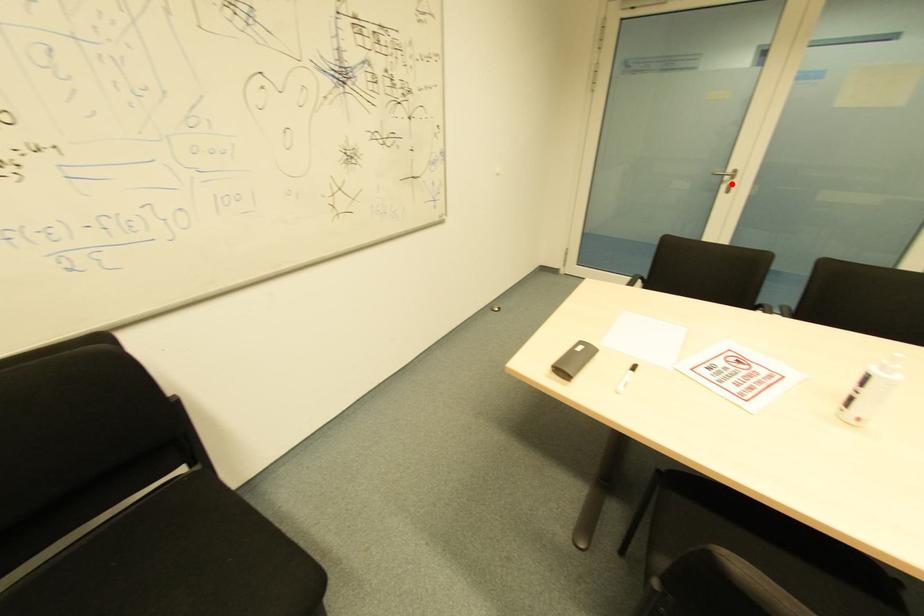
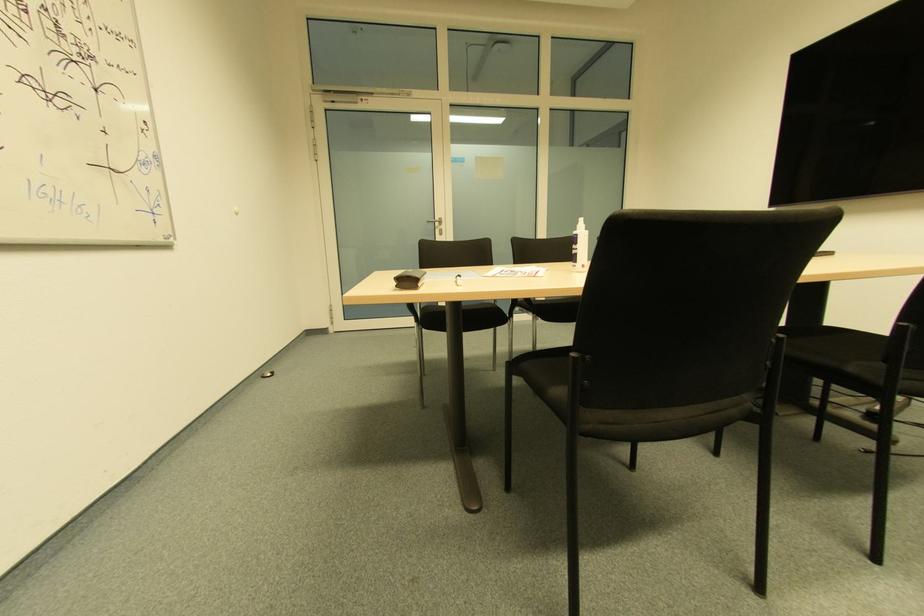
Question: I am providing you with two images of the same scene from different viewpoints. A red point is shown in image1. For the corresponding object point in image2, is it positioned nearer or farther from the camera?

Choices:
 (A) Nearer
 (B) Farther

Answer: (A)